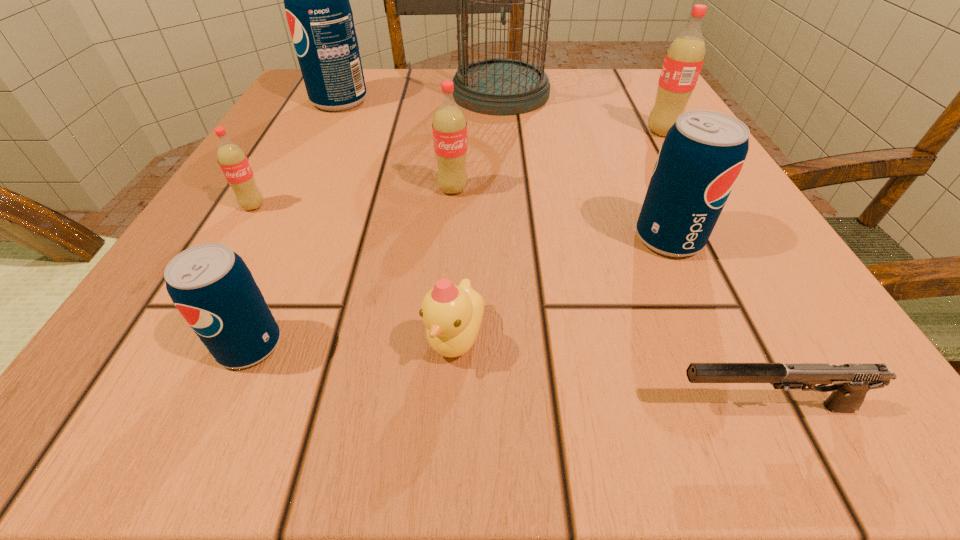
You are a GUI agent. You are given a task and a screenshot of the screen. Output one action in this format:
    pyautogui.click(x=<x>, y=<y>)
    Task: Click on the birdcage
    
    Given the screenshot: What is the action you would take?
    pyautogui.click(x=499, y=86)

Find the location of `the farthest soda`. the farthest soda is located at coordinates (319, 15).

The image size is (960, 540). In order to click on the biggest blue pop in this screenshot , I will do `click(319, 15)`.

You are a GUI agent. You are given a task and a screenshot of the screen. Output one action in this format:
    pyautogui.click(x=<x>, y=<y>)
    Task: Click on the farthest red soda
    This screenshot has height=540, width=960.
    Given the screenshot: What is the action you would take?
    pyautogui.click(x=684, y=59)

This screenshot has height=540, width=960. What are the coordinates of `the biggest red soda` in the screenshot? It's located at (684, 59).

In order to click on the fourth soda from left to right in this screenshot , I will do `click(449, 126)`.

Locate an element on the screen. The image size is (960, 540). the second smallest red soda is located at coordinates (449, 126).

The height and width of the screenshot is (540, 960). Identify the location of the fourth nearest object. (703, 153).

The height and width of the screenshot is (540, 960). In order to click on the fifth farthest soda in this screenshot , I will do `click(703, 153)`.

Where is `the nearest blue pop`? Image resolution: width=960 pixels, height=540 pixels. the nearest blue pop is located at coordinates (211, 286).